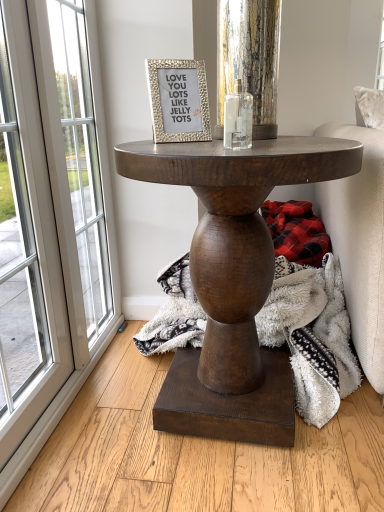
Question: Does plaid fabric at lower right have a larger size compared to clear glass candle holder at center?

Choices:
 (A) yes
 (B) no

Answer: (A)

Question: Can you confirm if plaid fabric at lower right is shorter than clear glass candle holder at center?

Choices:
 (A) no
 (B) yes

Answer: (A)

Question: Considering the relative positions of plaid fabric at lower right and clear glass candle holder at center in the image provided, is plaid fabric at lower right in front of clear glass candle holder at center?

Choices:
 (A) yes
 (B) no

Answer: (B)

Question: From the image's perspective, is plaid fabric at lower right under clear glass candle holder at center?

Choices:
 (A) yes
 (B) no

Answer: (A)

Question: Does plaid fabric at lower right appear on the right side of clear glass candle holder at center?

Choices:
 (A) yes
 (B) no

Answer: (A)

Question: From the image's perspective, does plaid fabric at lower right appear higher than clear glass candle holder at center?

Choices:
 (A) no
 (B) yes

Answer: (A)

Question: Is plaid fabric at lower right completely or partially inside gold textured frame at upper center?

Choices:
 (A) yes
 (B) no

Answer: (B)

Question: From a real-world perspective, is gold textured frame at upper center on plaid fabric at lower right?

Choices:
 (A) no
 (B) yes

Answer: (B)

Question: Considering the relative sizes of gold textured frame at upper center and plaid fabric at lower right in the image provided, is gold textured frame at upper center smaller than plaid fabric at lower right?

Choices:
 (A) no
 (B) yes

Answer: (B)

Question: Is gold textured frame at upper center positioned before plaid fabric at lower right?

Choices:
 (A) no
 (B) yes

Answer: (B)

Question: From the image's perspective, is gold textured frame at upper center on plaid fabric at lower right?

Choices:
 (A) no
 (B) yes

Answer: (B)

Question: Considering the relative sizes of gold textured frame at upper center and plaid fabric at lower right in the image provided, is gold textured frame at upper center taller than plaid fabric at lower right?

Choices:
 (A) no
 (B) yes

Answer: (A)

Question: Is white glass screen door at left taller than dark wood table at center?

Choices:
 (A) no
 (B) yes

Answer: (B)